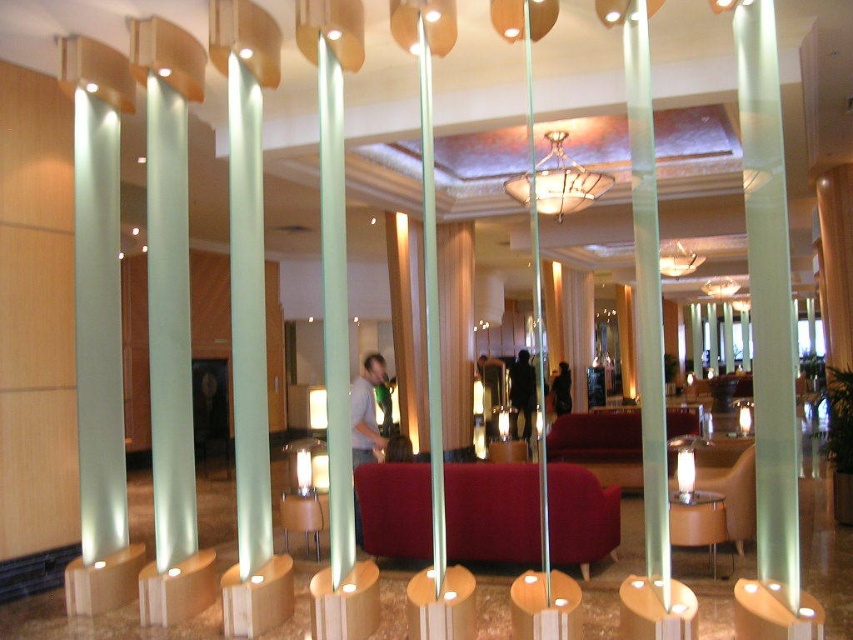
You are standing at the entrance of the lobby and want to walk straight ahead. Is the transparent glass pillar at center in your way?

The transparent glass pillar at center is located at point (x=646, y=304), which is directly in the path of someone walking straight ahead from the entrance. Therefore, the transparent glass pillar at center is in your way.